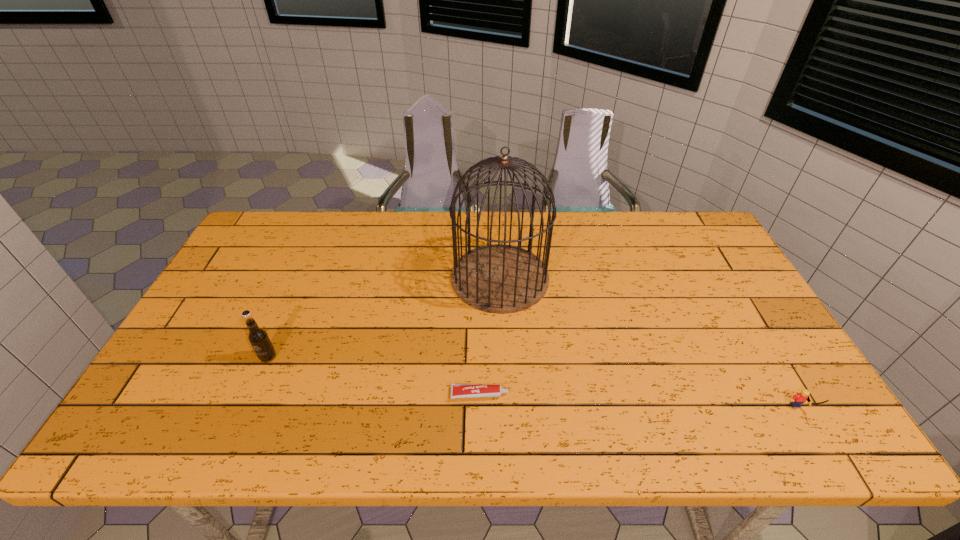
Where is `birdcage`? The image size is (960, 540). birdcage is located at coordinates (501, 279).

In order to click on the tallest object in this screenshot , I will do `click(501, 279)`.

In order to click on the third nearest object in this screenshot , I will do `click(257, 336)`.

Locate an element on the screen. The height and width of the screenshot is (540, 960). the leftmost object is located at coordinates (257, 336).

You are a GUI agent. You are given a task and a screenshot of the screen. Output one action in this format:
    pyautogui.click(x=<x>, y=<y>)
    Task: Click on the nearest object
    
    Given the screenshot: What is the action you would take?
    coord(796,401)

Locate an element on the screen. the rightmost object is located at coordinates (796, 401).

At what (x,y) coordinates should I click in order to perform the action: click on the shortest object. Please return your answer as a coordinate pair (x, y). Image resolution: width=960 pixels, height=540 pixels. Looking at the image, I should click on (457, 390).

Locate an element on the screen. the second nearest object is located at coordinates (457, 390).

Find the location of a particular element. The width and height of the screenshot is (960, 540). vacant space located at the door of the birdcage is located at coordinates (432, 278).

This screenshot has width=960, height=540. I want to click on vacant area located at the door of the birdcage, so click(370, 278).